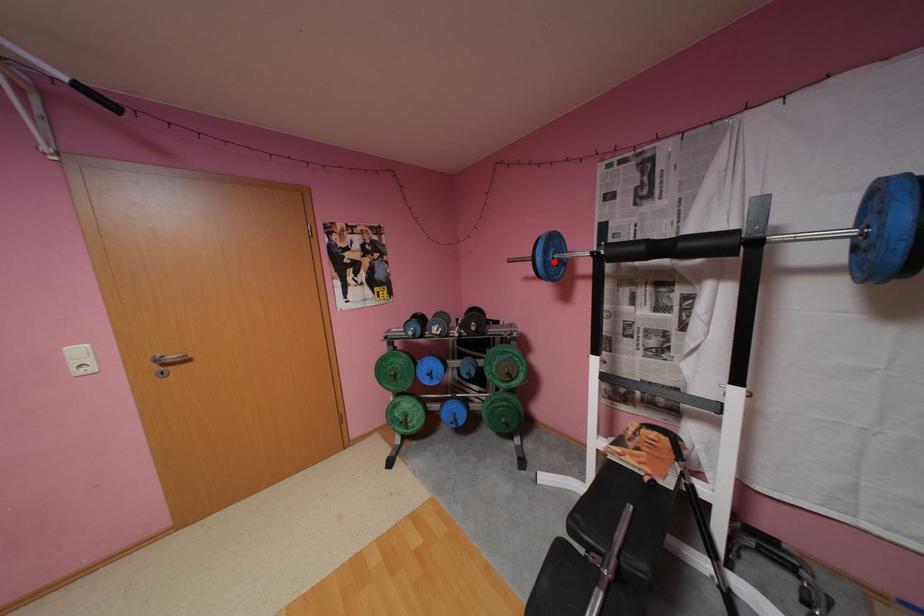
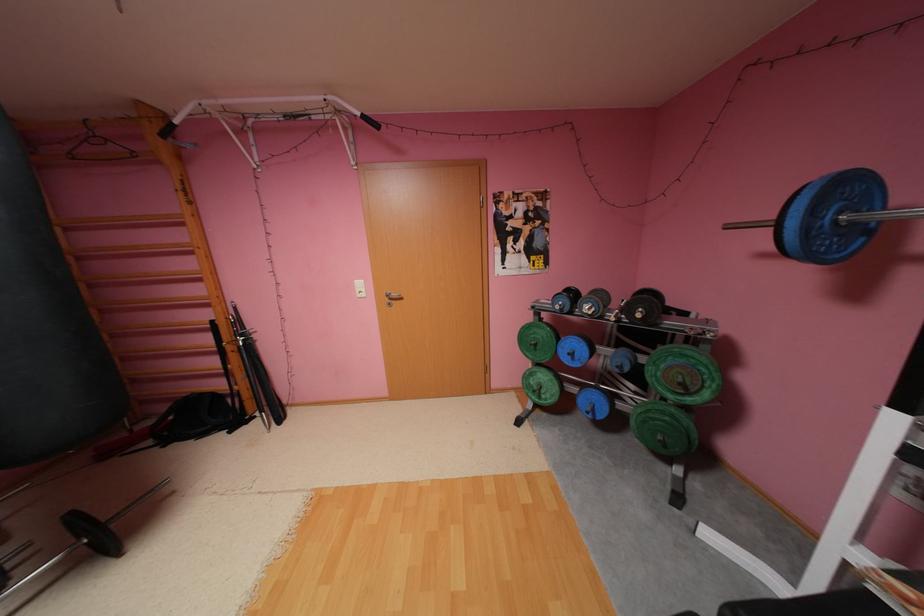
Locate, in the second image, the point that corresponds to the highlighted location in the first image.

(816, 229)